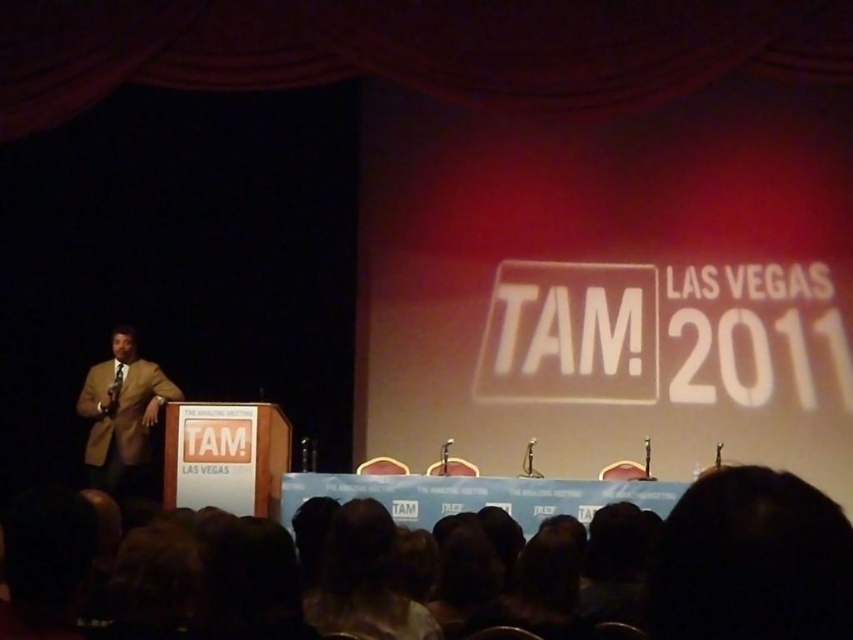
Between dark hair at lower right and light brown suit at left, which one is positioned higher?

dark hair at lower right is higher up.

Image resolution: width=853 pixels, height=640 pixels. What do you see at coordinates (751, 561) in the screenshot?
I see `dark hair at lower right` at bounding box center [751, 561].

Locate an element on the screen. This screenshot has height=640, width=853. dark hair at lower right is located at coordinates (751, 561).